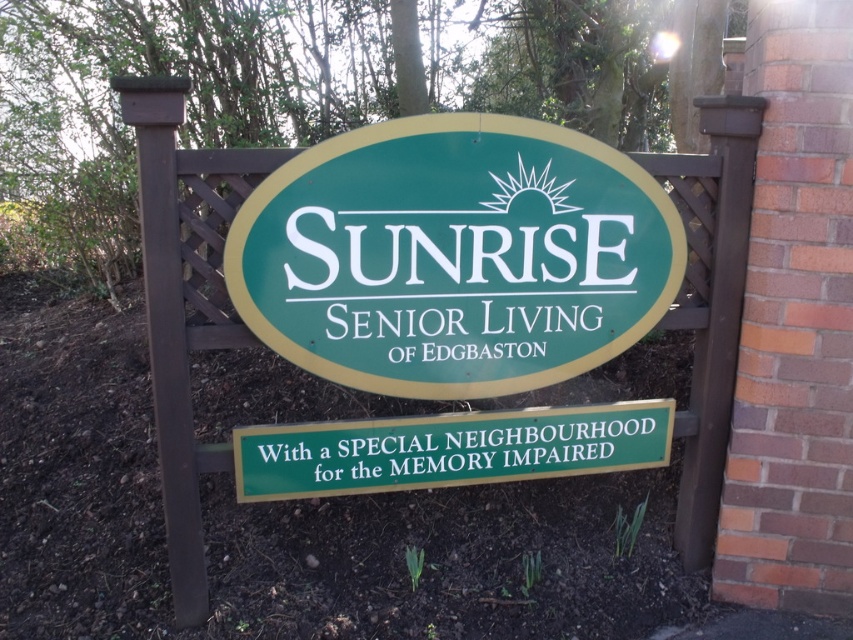
What is located at the coordinates point (454, 257)?

The green plastic sign at center is located at point (454, 257).